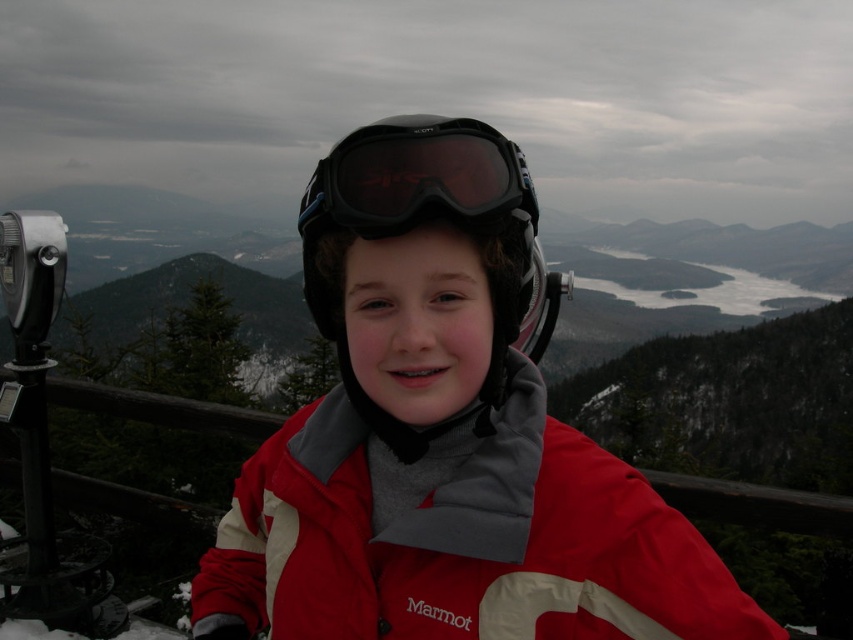
Consider the image. Can you confirm if black matte helmet at center is wider than black matte ski goggles at center?

Correct, the width of black matte helmet at center exceeds that of black matte ski goggles at center.

Does black matte helmet at center appear under black matte ski goggles at center?

No.

Locate an element on the screen. Image resolution: width=853 pixels, height=640 pixels. black matte helmet at center is located at coordinates tap(430, 205).

Does matte red jacket at center have a larger size compared to black matte helmet at center?

No, matte red jacket at center is not bigger than black matte helmet at center.

Does matte red jacket at center lie behind black matte helmet at center?

No, matte red jacket at center is in front of black matte helmet at center.

Between point (480, 228) and point (328, 172), which one is positioned in front?

Positioned in front is point (328, 172).

Identify the location of matte red jacket at center. The width and height of the screenshot is (853, 640). (444, 436).

Is matte red jacket at center to the right of black matte ski goggles at center from the viewer's perspective?

Yes, matte red jacket at center is to the right of black matte ski goggles at center.

Is matte red jacket at center behind black matte ski goggles at center?

No, matte red jacket at center is in front of black matte ski goggles at center.

Between point (643, 637) and point (384, 129), which one is positioned in front?

Positioned in front is point (643, 637).

The width and height of the screenshot is (853, 640). In order to click on matte red jacket at center in this screenshot , I will do `click(444, 436)`.